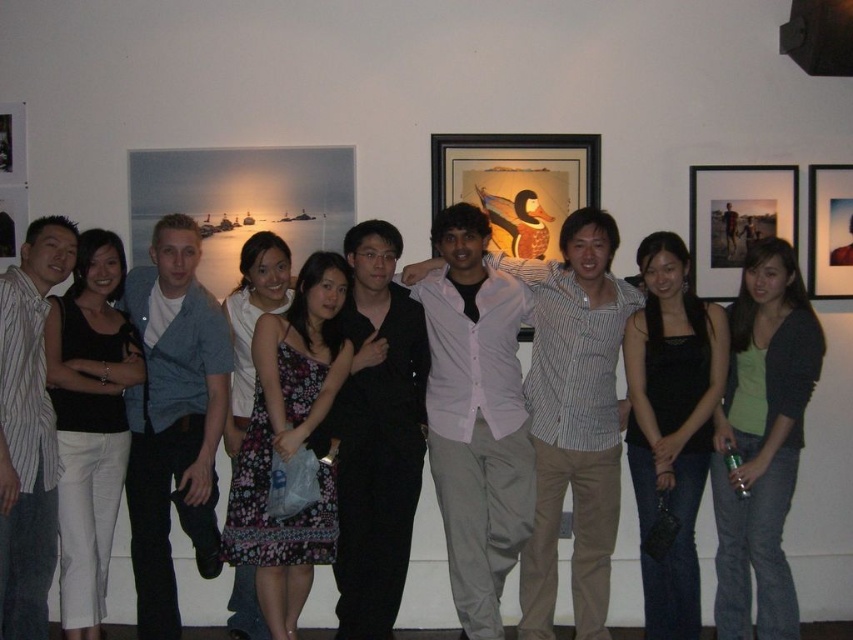
Question: Among these points, which one is farthest from the camera?

Choices:
 (A) (589, 248)
 (B) (755, 342)

Answer: (A)

Question: Is matte black frame at upper right further to the viewer compared to matte black portrait at upper right?

Choices:
 (A) yes
 (B) no

Answer: (B)

Question: Observing the image, what is the correct spatial positioning of pink button-up shirt at center in reference to wooden framed picture at center?

Choices:
 (A) right
 (B) left

Answer: (A)

Question: Is pink button-up shirt at center to the right of matte black portrait at upper right from the viewer's perspective?

Choices:
 (A) no
 (B) yes

Answer: (A)

Question: Which point is farther from the camera taking this photo?

Choices:
 (A) (775, 392)
 (B) (691, 570)

Answer: (B)

Question: Among these points, which one is nearest to the camera?

Choices:
 (A) click(x=349, y=536)
 (B) click(x=824, y=237)

Answer: (A)